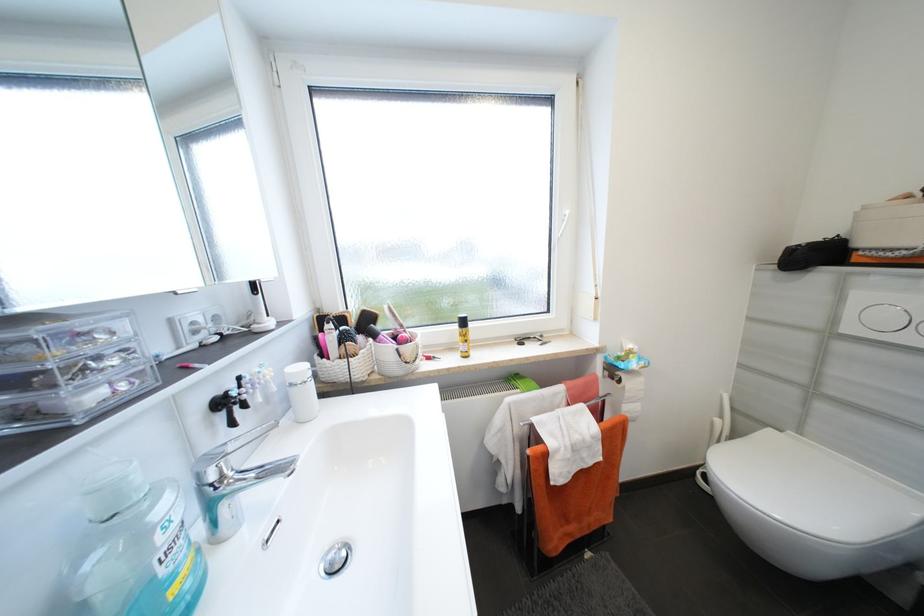
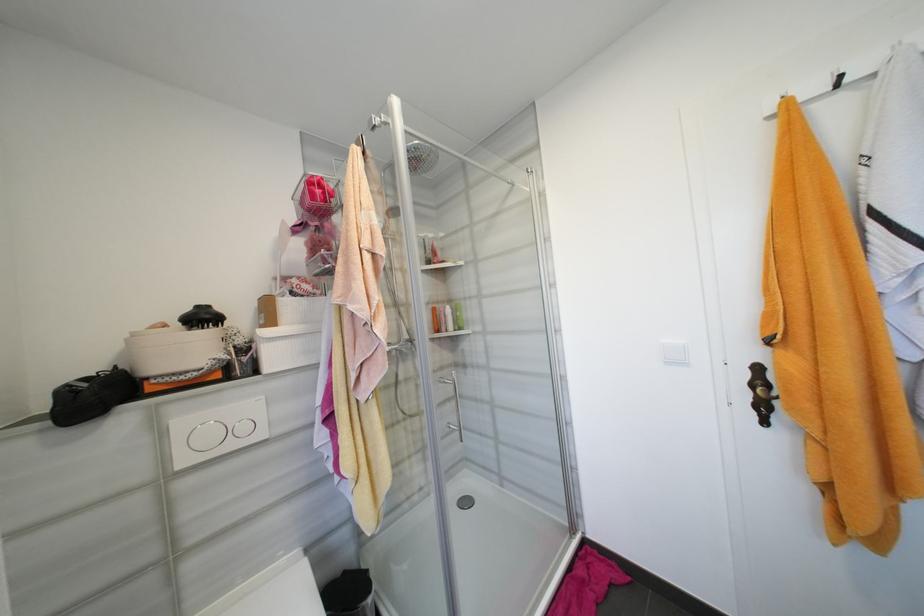
Where in the second image is the point corresponding to (855,330) from the first image?

(189, 463)